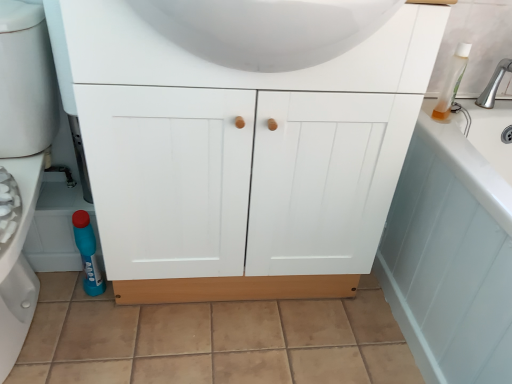
Where is `free region on the left part of blue plastic bottle at lower left`? This screenshot has height=384, width=512. free region on the left part of blue plastic bottle at lower left is located at coordinates (58, 282).